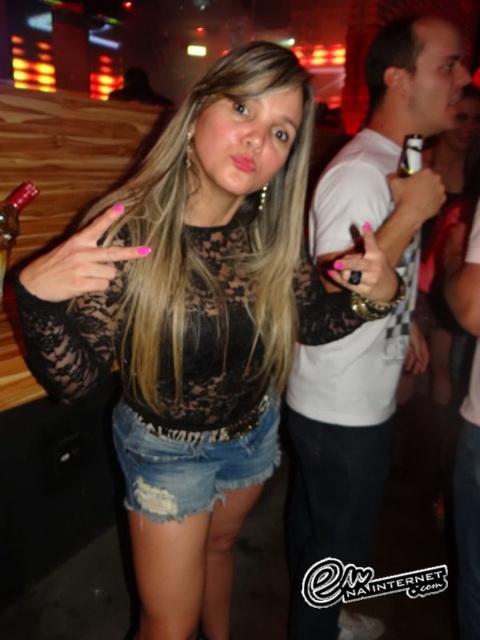
Question: Can you confirm if white matte t-shirt at center is positioned above metallic silver bottle at left?

Choices:
 (A) no
 (B) yes

Answer: (A)

Question: In this image, where is black matte ring at center located relative to metallic gold can opener at upper right?

Choices:
 (A) right
 (B) left

Answer: (B)

Question: Which object is farther from the camera taking this photo?

Choices:
 (A) pink matte nails at center
 (B) white matte t-shirt at center
 (C) black matte ring at center

Answer: (B)

Question: Which object appears farthest from the camera in this image?

Choices:
 (A) white matte t-shirt at center
 (B) denim shorts at center
 (C) metallic silver bottle at left
 (D) metallic gold can opener at upper right

Answer: (C)

Question: Which object appears farthest from the camera in this image?

Choices:
 (A) metallic silver bottle at left
 (B) metallic gold can opener at upper right
 (C) denim shorts at center
 (D) white matte t-shirt at center

Answer: (A)

Question: Is pink matte nails at center positioned before metallic silver bottle at left?

Choices:
 (A) yes
 (B) no

Answer: (A)